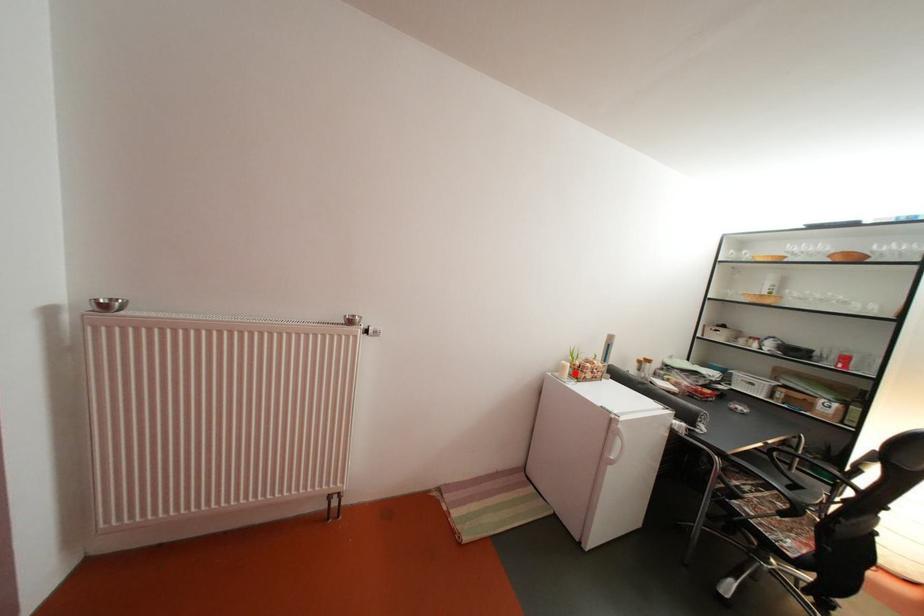
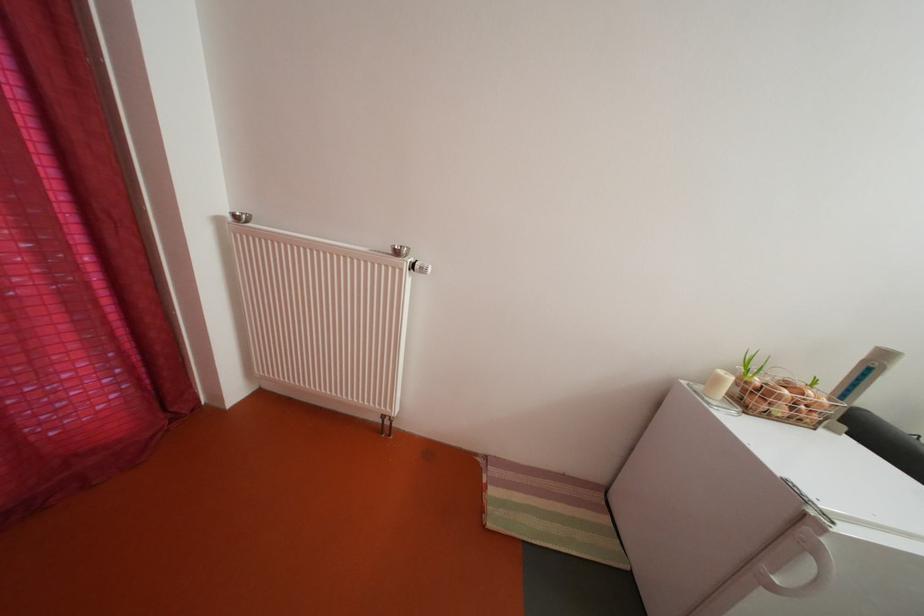
Locate, in the second image, the point that corresponds to the highlighted location in the first image.

(728, 386)